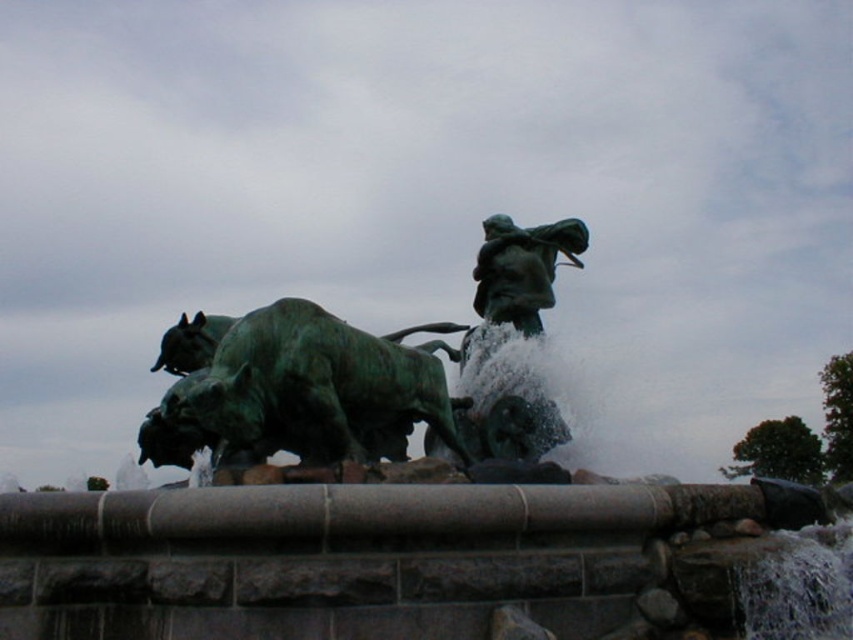
Consider the image. Is green patina statue at center wider than green patina bronze sculpture at center?

Correct, the width of green patina statue at center exceeds that of green patina bronze sculpture at center.

Does green patina statue at center have a smaller size compared to green patina bronze sculpture at center?

Incorrect, green patina statue at center is not smaller in size than green patina bronze sculpture at center.

This screenshot has width=853, height=640. In order to click on green patina statue at center in this screenshot , I will do `click(402, 515)`.

What are the coordinates of `green patina statue at center` in the screenshot? It's located at (402, 515).

Is point (517, 397) farther from camera compared to point (218, 412)?

Yes, it is.

Based on the photo, is green patina bronze sculpture at center shorter than green patina bull at center?

In fact, green patina bronze sculpture at center may be taller than green patina bull at center.

Which is behind, point (323, 420) or point (247, 417)?

The point (323, 420) is more distant.

Where is `green patina bronze sculpture at center`? This screenshot has width=853, height=640. green patina bronze sculpture at center is located at coordinates (322, 396).

Between green patina statue at center and green patina bull at center, which one appears on the right side from the viewer's perspective?

green patina bull at center

Does green patina statue at center appear on the right side of green patina bull at center?

Incorrect, green patina statue at center is not on the right side of green patina bull at center.

In order to click on green patina statue at center in this screenshot , I will do `click(402, 515)`.

Identify the location of green patina statue at center. (402, 515).